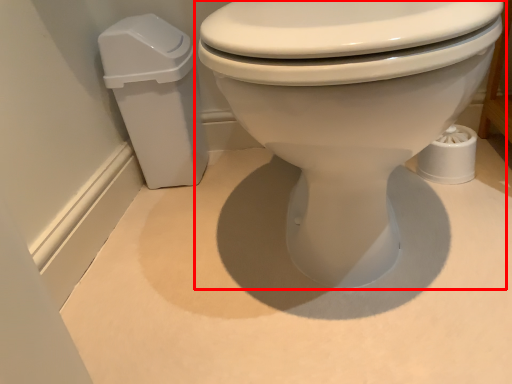
Question: From the image, what is the correct spatial relationship of toilet (annotated by the red box) in relation to porcelain?

Choices:
 (A) left
 (B) right

Answer: (B)